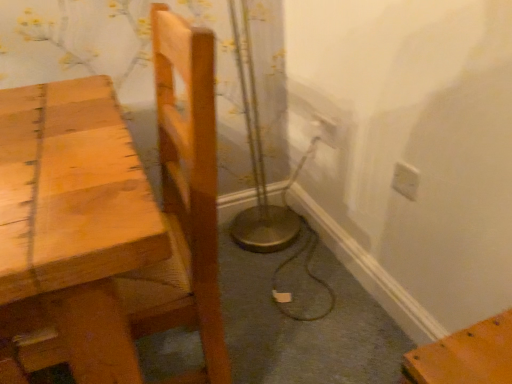
Question: From their relative heights in the image, would you say white plastic electric outlet at upper right, the first electric outlet in the back-to-front sequence, is taller or shorter than light brown wooden chair at left?

Choices:
 (A) tall
 (B) short

Answer: (B)

Question: Is white plastic electric outlet at upper right, acting as the 1th electric outlet starting from the left, in front of or behind light brown wooden chair at left in the image?

Choices:
 (A) behind
 (B) front

Answer: (A)

Question: Estimate the real-world distances between objects in this image. Which object is closer to the white plastic electric outlet at upper right, which is the 2th electric outlet in back-to-front order?

Choices:
 (A) light brown wooden chair at left
 (B) white plastic electric outlet at upper right, the second electric outlet positioned from the right

Answer: (B)

Question: Estimate the real-world distances between objects in this image. Which object is farther from the white plastic electric outlet at upper right, which is counted as the 2th electric outlet, starting from the front?

Choices:
 (A) white plastic electric outlet at upper right, the second electric outlet when ordered from left to right
 (B) light brown wooden chair at left

Answer: (B)